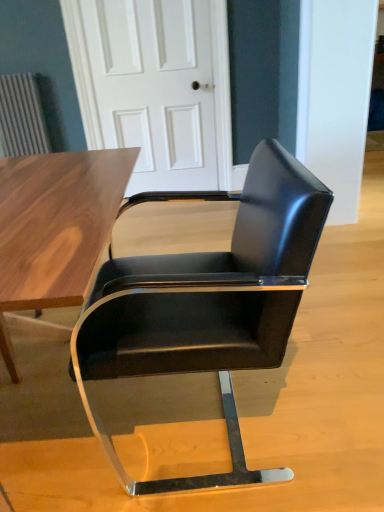
You are a GUI agent. You are given a task and a screenshot of the screen. Output one action in this format:
    pyautogui.click(x=<x>, y=<y>)
    Task: Click on the free region under black leather chair at center (from a real-world perspective)
    
    Given the screenshot: What is the action you would take?
    pyautogui.click(x=187, y=426)